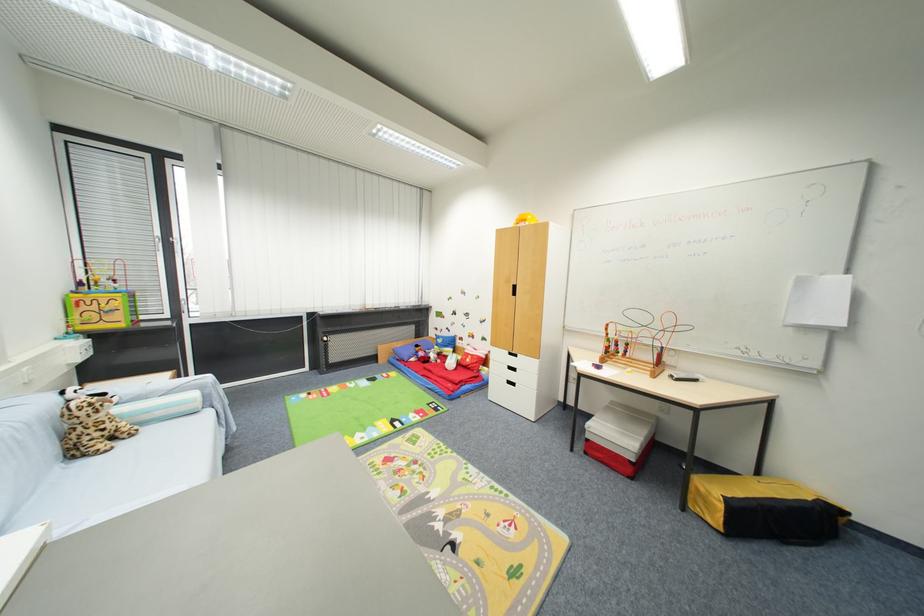
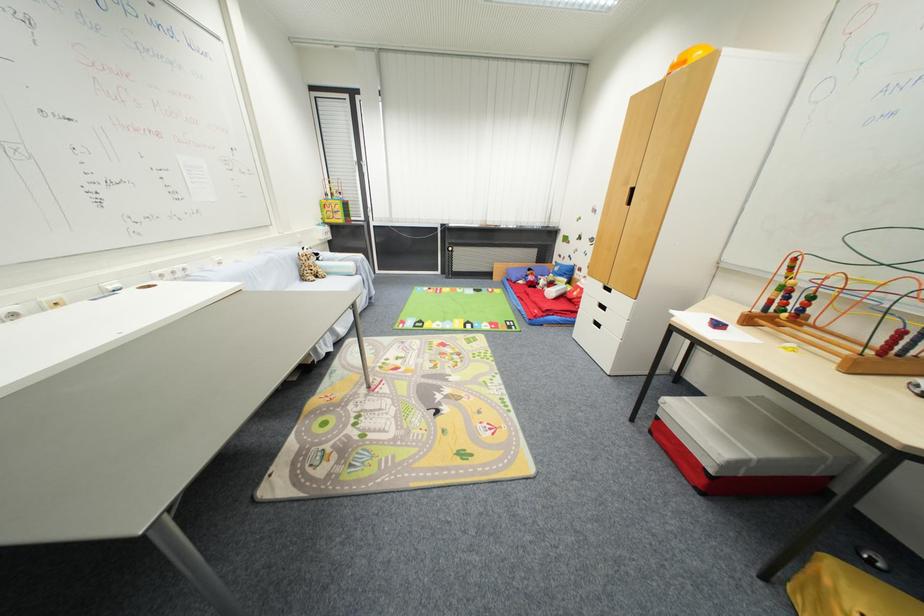
Where in the second image is the point corresponding to (55,453) from the first image?

(300, 276)